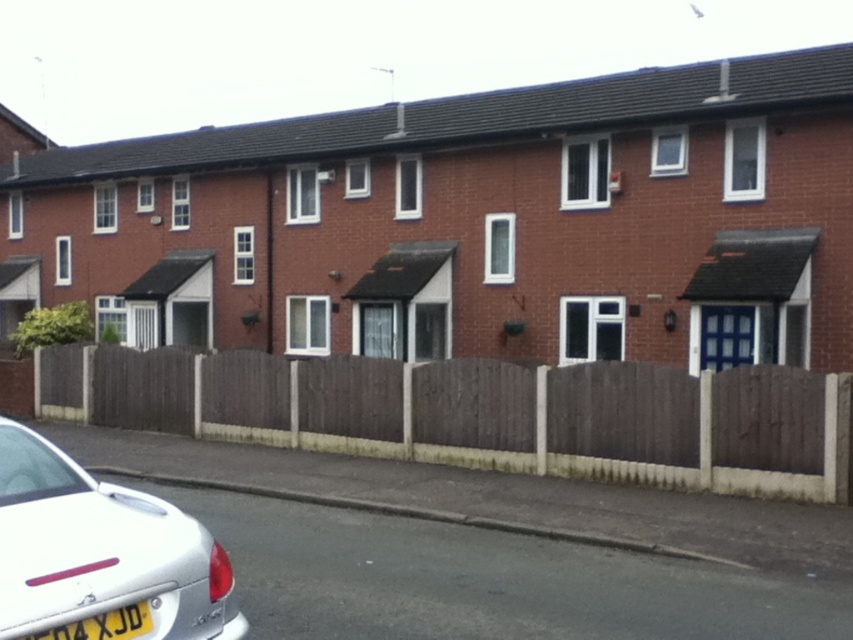
Find the location of `brown wooden fence at lower left`. brown wooden fence at lower left is located at coordinates (486, 413).

Who is more distant from viewer, (138, 410) or (28, 593)?

Positioned behind is point (138, 410).

Between point (734, 442) and point (143, 612), which one is positioned behind?

The point (734, 442) is behind.

Locate an element on the screen. The image size is (853, 640). brown wooden fence at lower left is located at coordinates (486, 413).

Which is in front, point (683, 406) or point (68, 630)?

Point (68, 630) is more forward.

Is brown wooden fence at lower left positioned before yellow plastic license plate at lower left?

No, brown wooden fence at lower left is further to the viewer.

This screenshot has height=640, width=853. What do you see at coordinates (486, 413) in the screenshot?
I see `brown wooden fence at lower left` at bounding box center [486, 413].

Locate an element on the screen. The width and height of the screenshot is (853, 640). brown wooden fence at lower left is located at coordinates (486, 413).

The height and width of the screenshot is (640, 853). I want to click on white glossy car at lower left, so click(100, 556).

Does white glossy car at lower left appear on the right side of yellow plastic license plate at lower left?

In fact, white glossy car at lower left is to the left of yellow plastic license plate at lower left.

Is point (47, 442) positioned behind point (141, 616)?

Yes, point (47, 442) is behind point (141, 616).

Where is `white glossy car at lower left`? The image size is (853, 640). white glossy car at lower left is located at coordinates (100, 556).